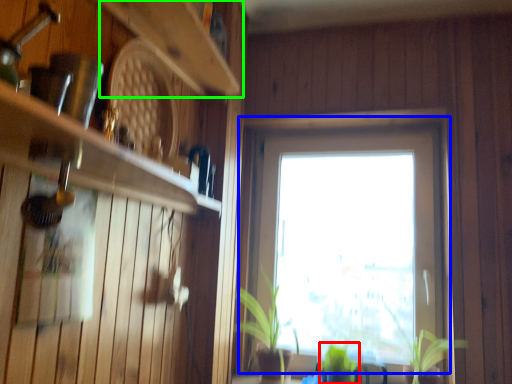
Question: Based on their relative distances, which object is nearer to plant (highlighted by a red box)? Choose from window (highlighted by a blue box) and shelf (highlighted by a green box).

Choices:
 (A) window
 (B) shelf

Answer: (A)